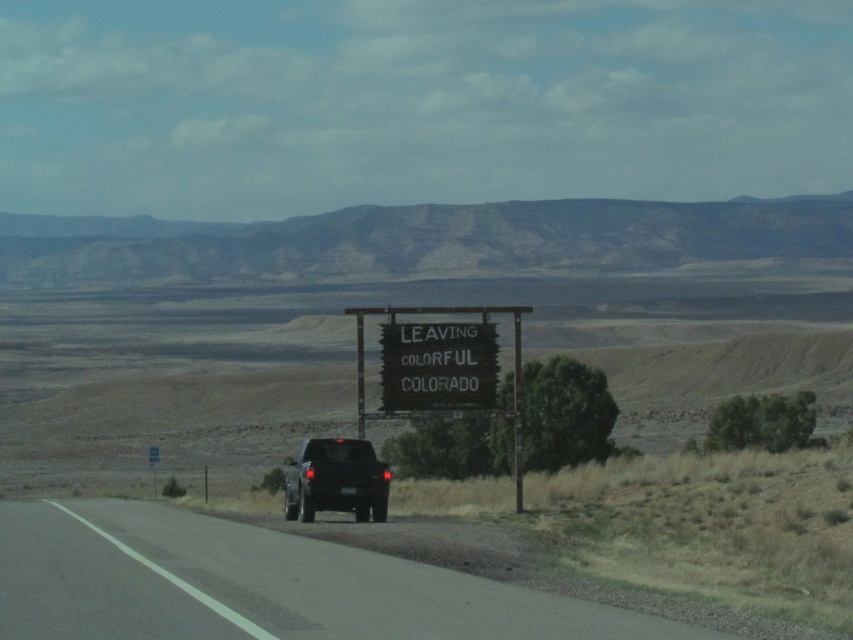
Question: Is black plastic sign at center below matte black truck at center?

Choices:
 (A) yes
 (B) no

Answer: (B)

Question: Among these objects, which one is farthest from the camera?

Choices:
 (A) wooden signboard at center
 (B) matte black truck at center
 (C) black asphalt road at center

Answer: (A)

Question: Which of the following is the closest to the observer?

Choices:
 (A) (129, 544)
 (B) (397, 410)
 (C) (421, 332)
 (D) (366, 490)

Answer: (A)

Question: Which point appears farthest from the camera in this image?

Choices:
 (A) (495, 381)
 (B) (358, 342)
 (C) (312, 588)

Answer: (A)

Question: Does black plastic sign at center appear on the left side of matte black truck at center?

Choices:
 (A) no
 (B) yes

Answer: (A)

Question: In this image, where is black asphalt road at center located relative to wooden signboard at center?

Choices:
 (A) below
 (B) above

Answer: (A)